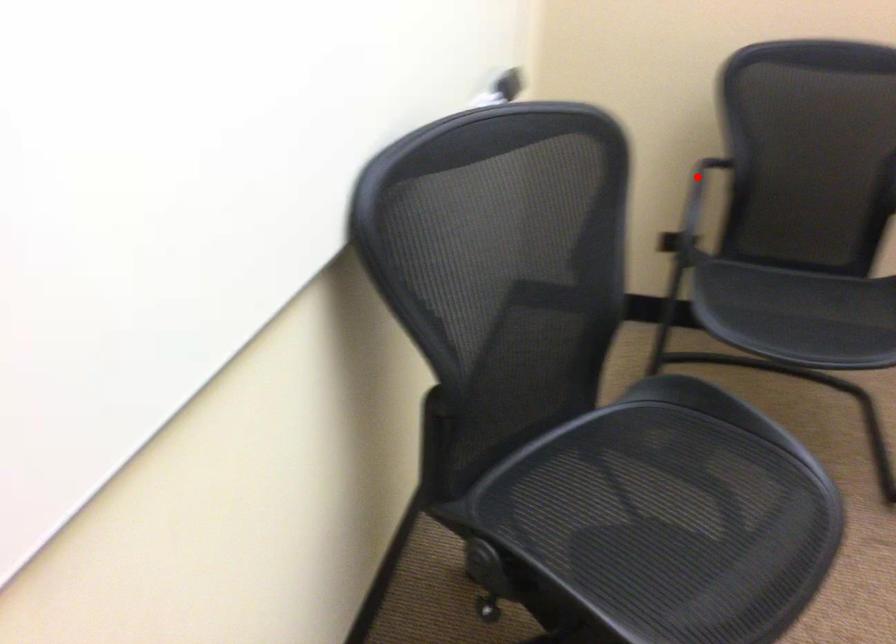
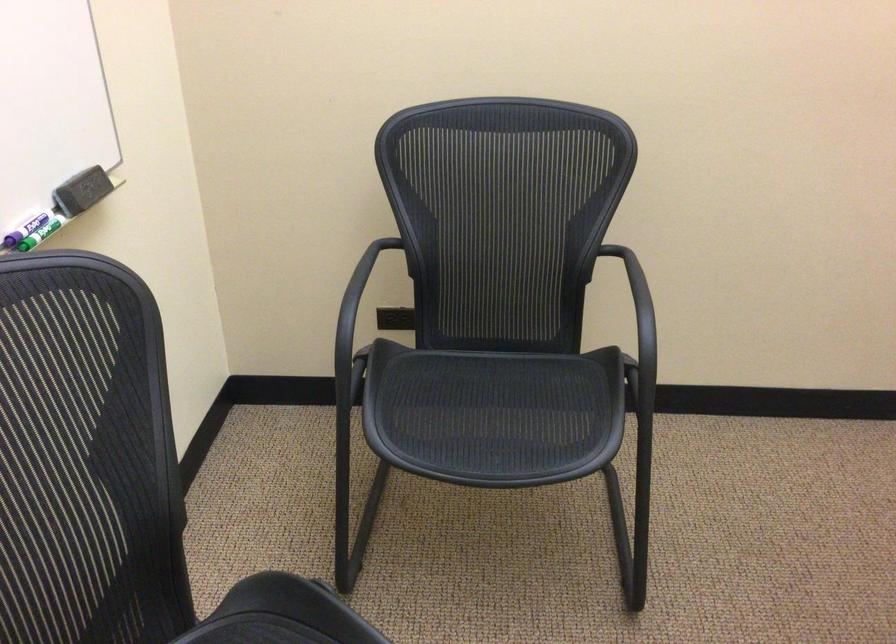
Question: I am providing you with two images of the same scene from different viewpoints. Image1 has a red point marked. In image2, the corresponding 3D location appears at what relative position? Reply with the corresponding letter.

Choices:
 (A) Closer
 (B) Farther

Answer: (A)